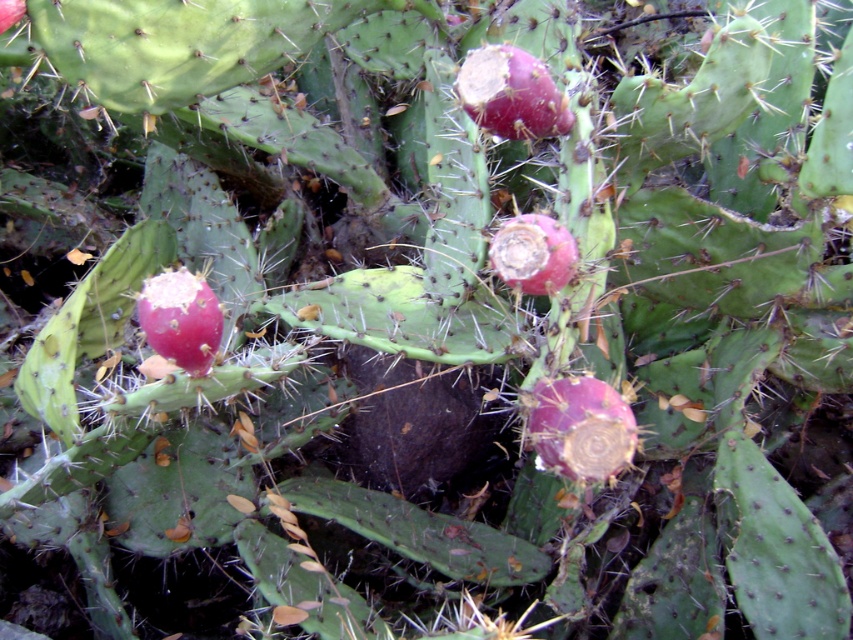
Does purple matte prickly pear cactus fruit at center have a smaller size compared to pink matte prickly pear cactus fruit at center?

Incorrect, purple matte prickly pear cactus fruit at center is not smaller in size than pink matte prickly pear cactus fruit at center.

Which is more to the left, purple matte prickly pear cactus fruit at center or pink matte prickly pear cactus fruit at center?

A: pink matte prickly pear cactus fruit at center is more to the left.

Between point (601, 461) and point (473, 92), which one is positioned in front?

Point (601, 461)

Identify the location of purple matte prickly pear cactus fruit at center. (579, 428).

Is point (518, 90) positioned behind point (498, 243)?

Yes, point (518, 90) is behind point (498, 243).

Is pink matte prickly pear cactus fruit at center bigger than matte pink cactus fruit at center?

No.

Is point (474, 61) in front of point (524, 285)?

No.

You are a GUI agent. You are given a task and a screenshot of the screen. Output one action in this format:
    pyautogui.click(x=<x>, y=<y>)
    Task: Click on the pink matte prickly pear cactus fruit at center
    The image size is (853, 640).
    Given the screenshot: What is the action you would take?
    pyautogui.click(x=511, y=93)

Is smooth red cactus fruit at center wider than matte pink cactus fruit at center?

No, smooth red cactus fruit at center is not wider than matte pink cactus fruit at center.

What do you see at coordinates (180, 317) in the screenshot? I see `smooth red cactus fruit at center` at bounding box center [180, 317].

This screenshot has width=853, height=640. I want to click on smooth red cactus fruit at center, so click(180, 317).